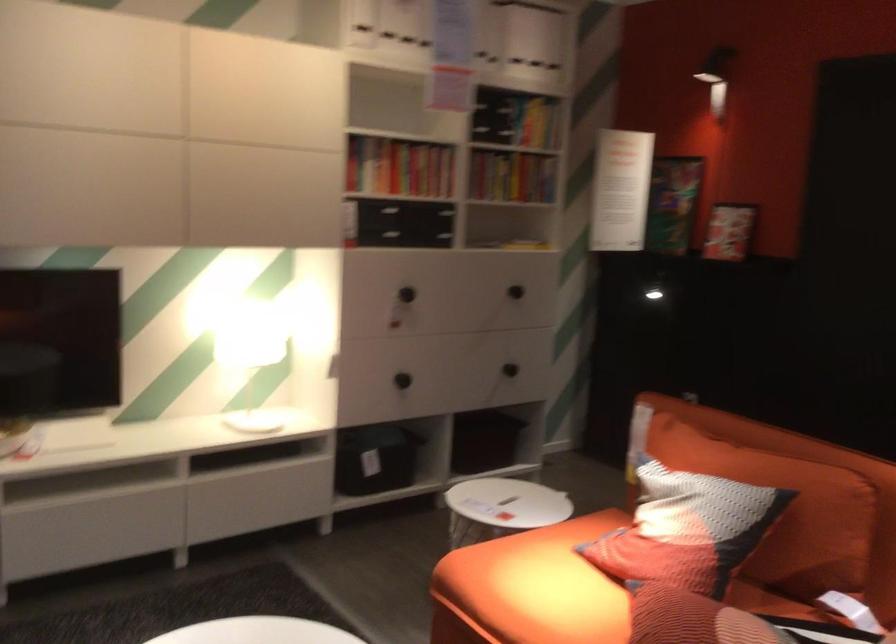
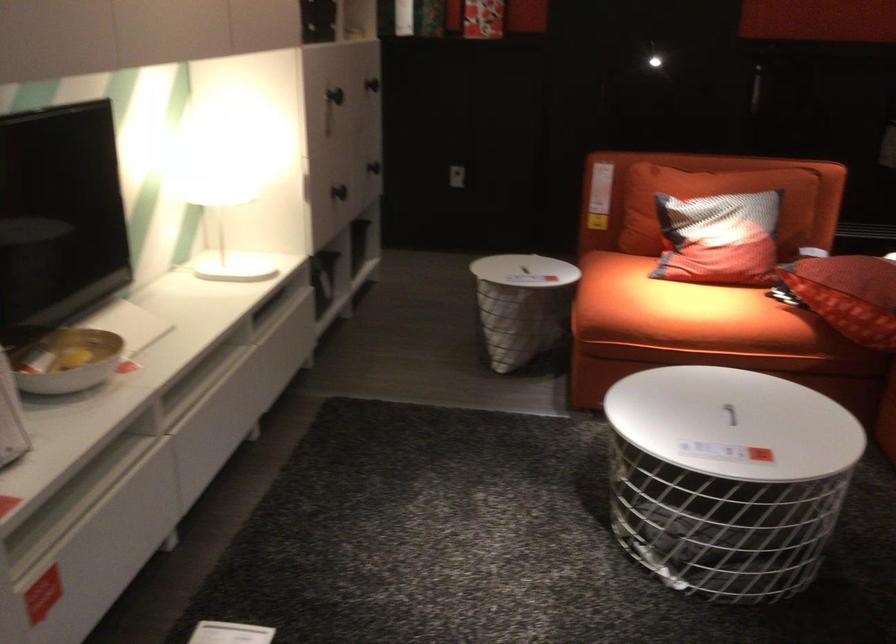
The point at [510,500] is marked in the first image. Where is the corresponding point in the second image?

(522, 270)